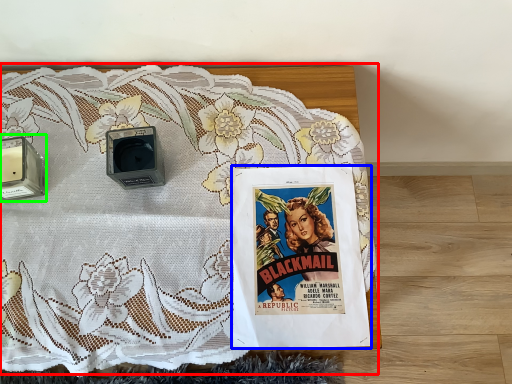
Question: Which object is the farthest from bed (highlighted by a red box)? Choose among these: comic book (highlighted by a blue box) or speaker (highlighted by a green box).

Choices:
 (A) comic book
 (B) speaker

Answer: (B)